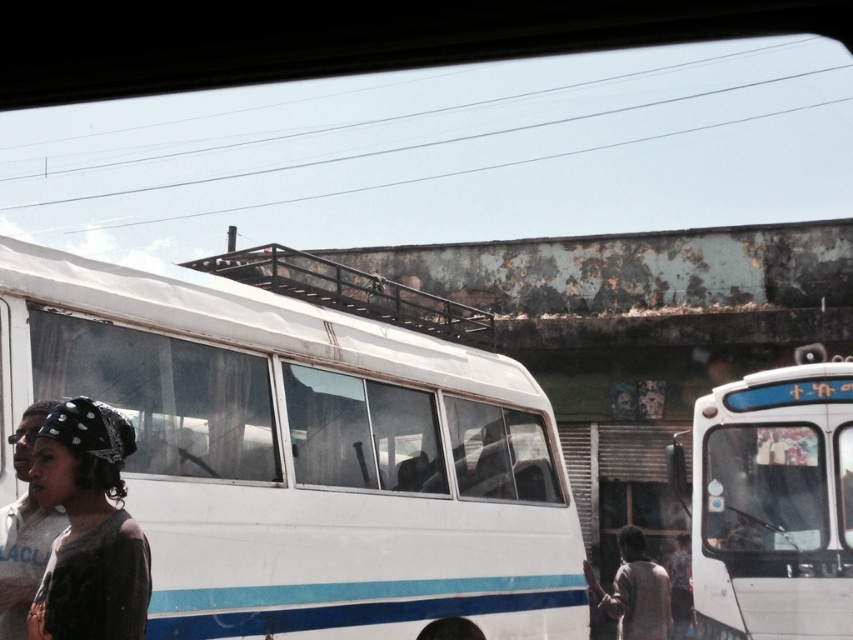
Which is behind, point (113, 484) or point (642, 552)?

Point (642, 552)

Measure the distance between point [103,598] and camera.

Point [103,598] and camera are 3.61 meters apart.

Does point (122, 589) lie behind point (587, 582)?

No, (122, 589) is closer to viewer.

Find the location of a particular element. black textured headscarf at lower left is located at coordinates (88, 529).

Who is more distant from viewer, [775,474] or [631,568]?

Point [631,568]

Is white matte bus at right wider than brown textured jacket at lower right?

Correct, the width of white matte bus at right exceeds that of brown textured jacket at lower right.

Is point (672, 476) closer to camera compared to point (664, 600)?

No, it is not.

The image size is (853, 640). Find the location of `white matte bus at right`. white matte bus at right is located at coordinates coord(772,502).

Where is `white matte bus at center`? white matte bus at center is located at coordinates (305, 458).

Is white matte bus at center bigger than black textured headscarf at lower left?

Yes.

The width and height of the screenshot is (853, 640). What are the coordinates of `white matte bus at center` in the screenshot? It's located at (305, 458).